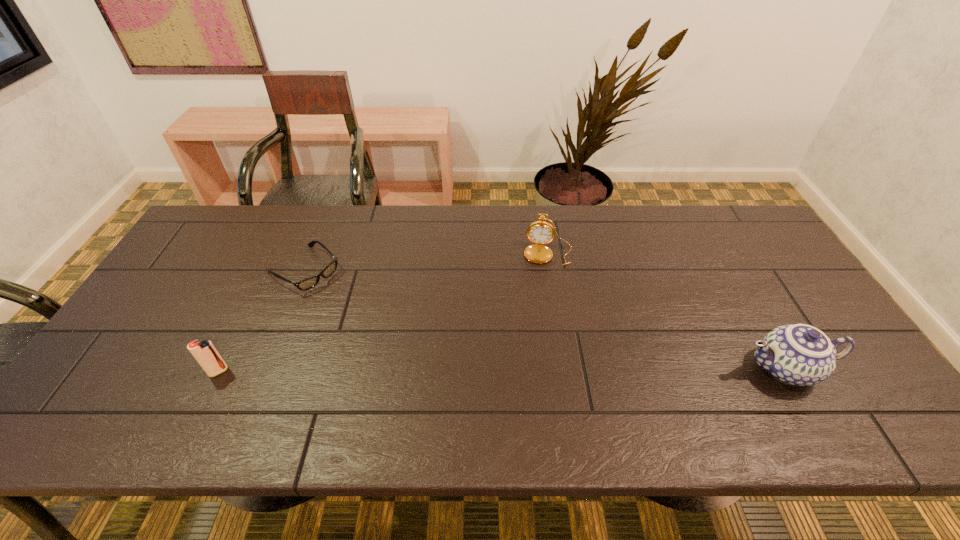
This screenshot has width=960, height=540. In order to click on vacant point located 0.220m on the front-facing side of the spectacles in this screenshot , I will do `click(376, 325)`.

Locate an element on the screen. Image resolution: width=960 pixels, height=540 pixels. free space located 0.220m on the face of the third object from left to right is located at coordinates 541,321.

In order to click on vacant point located on the face of the third object from left to right in this screenshot , I will do `click(544, 287)`.

Where is `blank area located on the face of the third object from left to right`? Image resolution: width=960 pixels, height=540 pixels. blank area located on the face of the third object from left to right is located at coordinates (540, 327).

Identify the location of spectacles that is positioned at the far edge. (308, 283).

The width and height of the screenshot is (960, 540). I want to click on pocket watch that is at the far edge, so click(x=540, y=233).

You are a GUI agent. You are given a task and a screenshot of the screen. Output one action in this format:
    pyautogui.click(x=<x>, y=<y>)
    Task: Click on the igniter located in the near edge section of the desktop
    The height and width of the screenshot is (540, 960).
    Given the screenshot: What is the action you would take?
    pyautogui.click(x=205, y=353)

Identify the location of chinaware at the near edge. This screenshot has width=960, height=540. (801, 355).

Identify the location of object at the right edge. Image resolution: width=960 pixels, height=540 pixels. (801, 355).

You are a GUI agent. You are given a task and a screenshot of the screen. Output one action in this format:
    pyautogui.click(x=<x>, y=<y>)
    Task: Click on the object present at the near right corner
    
    Given the screenshot: What is the action you would take?
    pyautogui.click(x=801, y=355)